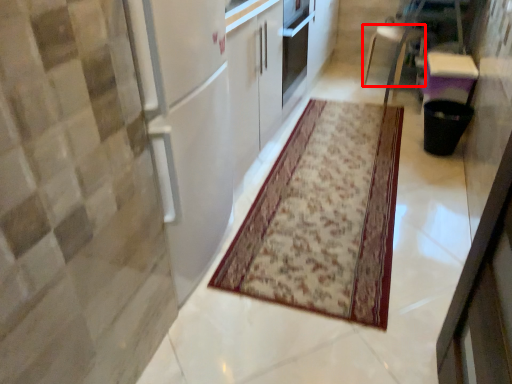
Question: From the image's perspective, what is the correct spatial positioning of furniture (annotated by the red box) in reference to mat?

Choices:
 (A) below
 (B) above

Answer: (B)